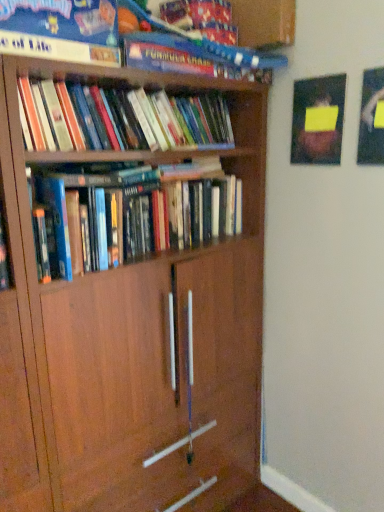
Question: Is hardcover book at upper center, the third book in the bottom-to-top sequence, bigger than hardcover books at center, which ranks as the first book in bottom-to-top order?

Choices:
 (A) yes
 (B) no

Answer: (B)

Question: Is hardcover book at upper center, the third book in the bottom-to-top sequence, turned away from hardcover books at center, which is the third book in top-to-bottom order?

Choices:
 (A) no
 (B) yes

Answer: (A)

Question: Is hardcover book at upper center, which is the 1th book in top-to-bottom order, directly adjacent to hardcover books at center, which ranks as the first book in bottom-to-top order?

Choices:
 (A) no
 (B) yes

Answer: (A)

Question: From a real-world perspective, is hardcover book at upper center, the third book in the bottom-to-top sequence, physically below hardcover books at center, which ranks as the first book in bottom-to-top order?

Choices:
 (A) no
 (B) yes

Answer: (A)

Question: Can we say hardcover book at upper center, the third book in the bottom-to-top sequence, lies outside hardcover books at center, which is the third book in top-to-bottom order?

Choices:
 (A) yes
 (B) no

Answer: (A)

Question: Is hardcover books at upper left, which is counted as the second book, starting from the top, wider or thinner than hardcover book at upper center, the third book in the bottom-to-top sequence?

Choices:
 (A) thin
 (B) wide

Answer: (A)

Question: Would you say hardcover books at upper left, the second book in the bottom-to-top sequence, is to the left or to the right of hardcover book at upper center, which is the 1th book in top-to-bottom order, in the picture?

Choices:
 (A) right
 (B) left

Answer: (B)

Question: Is point (114, 94) positioned closer to the camera than point (249, 50)?

Choices:
 (A) farther
 (B) closer

Answer: (B)

Question: Is hardcover books at upper left, the second book in the bottom-to-top sequence, bigger or smaller than hardcover book at upper center, which is the 1th book in top-to-bottom order?

Choices:
 (A) big
 (B) small

Answer: (B)

Question: From a real-world perspective, is hardcover book at upper center, which is the 1th book in top-to-bottom order, positioned above or below hardcover books at center, which ranks as the first book in bottom-to-top order?

Choices:
 (A) below
 (B) above

Answer: (B)

Question: From the image's perspective, is hardcover book at upper center, which is the 1th book in top-to-bottom order, above or below hardcover books at center, which ranks as the first book in bottom-to-top order?

Choices:
 (A) above
 (B) below

Answer: (A)

Question: In terms of size, does hardcover book at upper center, the third book in the bottom-to-top sequence, appear bigger or smaller than hardcover books at center, which is the third book in top-to-bottom order?

Choices:
 (A) big
 (B) small

Answer: (B)

Question: Is point click(203, 72) positioned closer to the camera than point click(142, 231)?

Choices:
 (A) farther
 (B) closer

Answer: (B)

Question: In terms of size, does hardcover books at center, which ranks as the first book in bottom-to-top order, appear bigger or smaller than hardcover book at upper center, which is the 1th book in top-to-bottom order?

Choices:
 (A) big
 (B) small

Answer: (A)

Question: In terms of width, does hardcover books at center, which is the third book in top-to-bottom order, look wider or thinner when compared to hardcover book at upper center, the third book in the bottom-to-top sequence?

Choices:
 (A) thin
 (B) wide

Answer: (A)